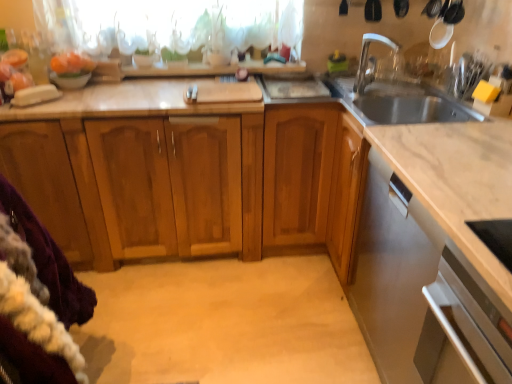
I want to click on free space in front of white glossy bowl at upper left, so click(x=75, y=102).